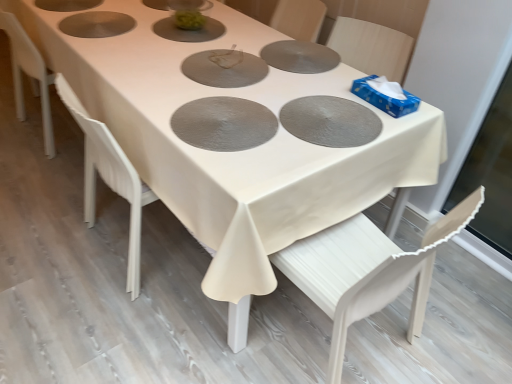
At what (x,y) coordinates should I click in order to perform the action: click on vacant area located to the right-hand side of matte gray pizza pan at center, which ranks as the 1th pizza pan in top-to-bottom order. Please return your answer as a coordinate pair (x, y). Looking at the image, I should click on (294, 67).